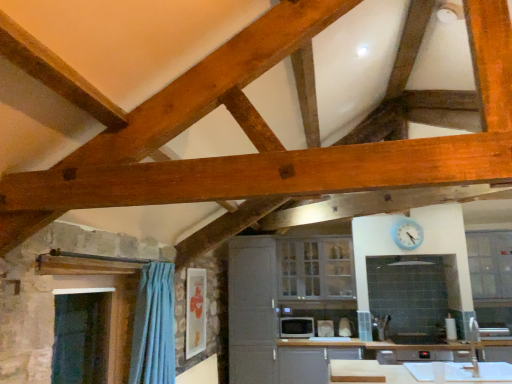
Question: In terms of width, does white glossy cabinet at center, the first cabinetry in the left-to-right sequence, look wider or thinner when compared to white glossy microwave at center, which ranks as the first appliance in right-to-left order?

Choices:
 (A) thin
 (B) wide

Answer: (B)

Question: From a real-world perspective, relative to white glossy microwave at center, which ranks as the first appliance in right-to-left order, is white glossy cabinet at center, acting as the 2th cabinetry starting from the right, vertically above or below?

Choices:
 (A) above
 (B) below

Answer: (A)

Question: Considering the real-world distances, which object is closest to the clear glass window at upper right?

Choices:
 (A) matte black microwave at center, the first appliance viewed from the left
 (B) white glossy cabinet at center, which is counted as the 2th cabinetry, starting from the left
 (C) blue plastic clock at upper center
 (D) white glossy microwave at center, which ranks as the first appliance in right-to-left order
 (E) transparent plastic window screen at left

Answer: (C)

Question: Estimate the real-world distances between objects in this image. Which object is closer to the matte black microwave at center, the first appliance viewed from the left?

Choices:
 (A) clear glass window at upper right
 (B) white glossy cabinet at center, acting as the 2th cabinetry starting from the right
 (C) white glossy cabinet at center, which is counted as the 2th cabinetry, starting from the left
 (D) blue plastic clock at upper center
 (E) transparent plastic window screen at left

Answer: (B)